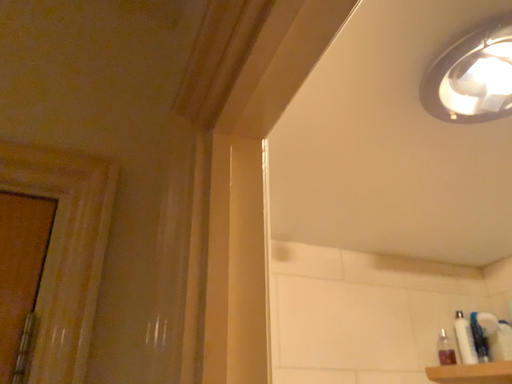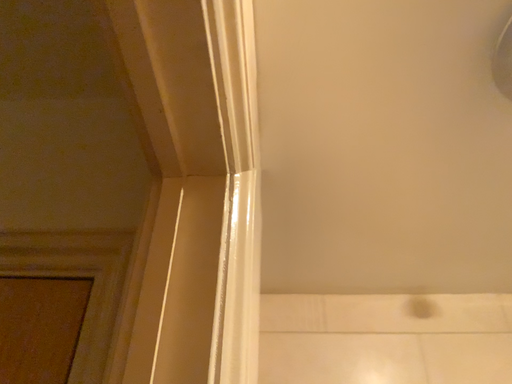
Question: How did the camera likely rotate when shooting the video?

Choices:
 (A) rotated downward
 (B) rotated upward

Answer: (B)